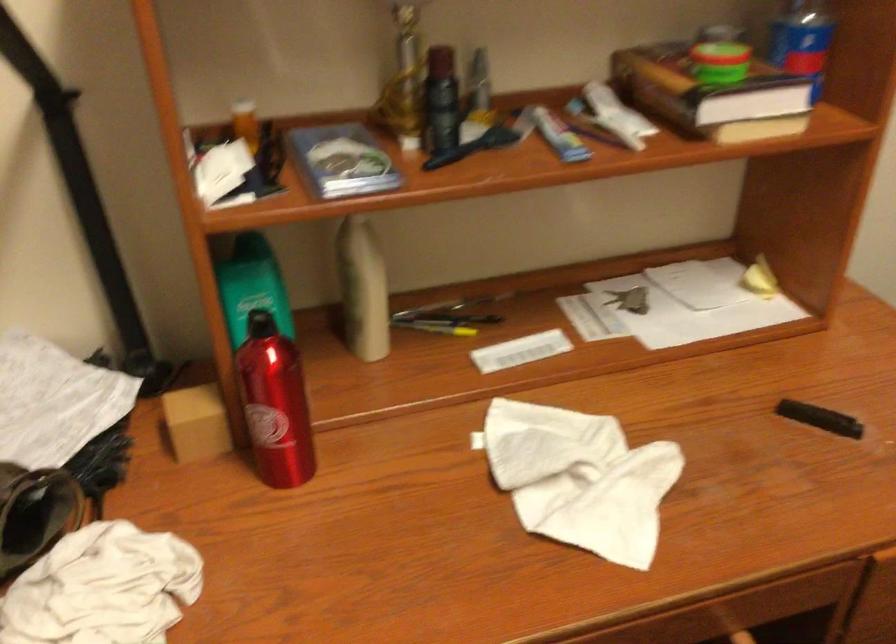
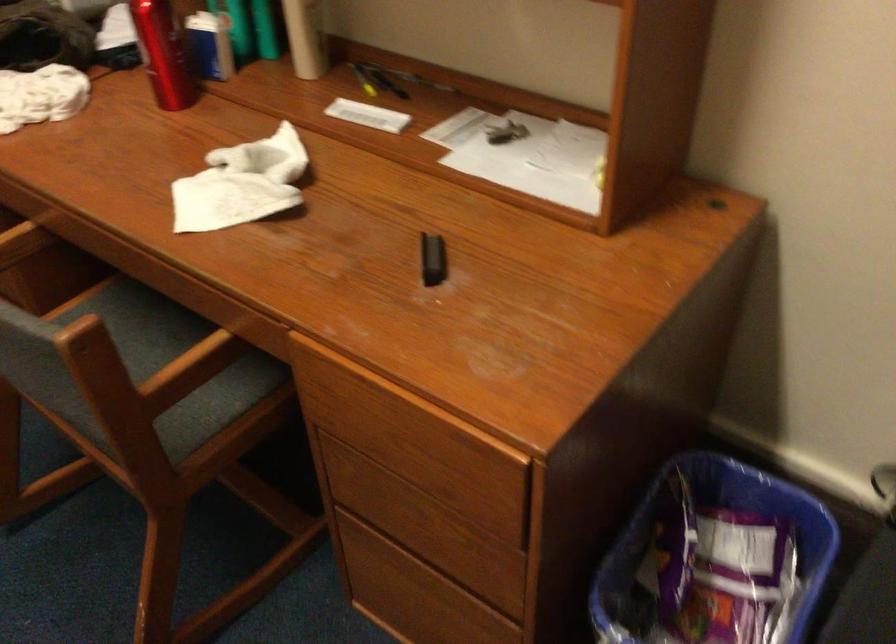
The point at (290, 415) is marked in the first image. Where is the corresponding point in the second image?

(162, 53)